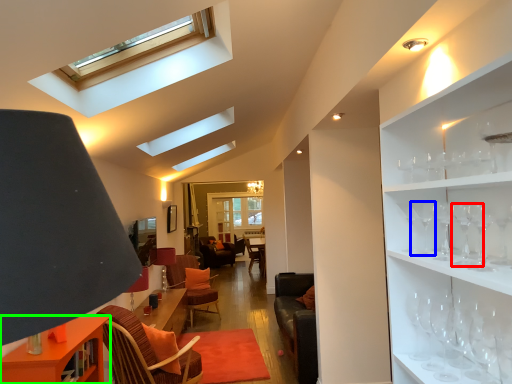
Question: Based on their relative distances, which object is farther from wine glass (highlighted by a red box)? Choose from wine glass (highlighted by a blue box) and table (highlighted by a green box).

Choices:
 (A) wine glass
 (B) table

Answer: (B)